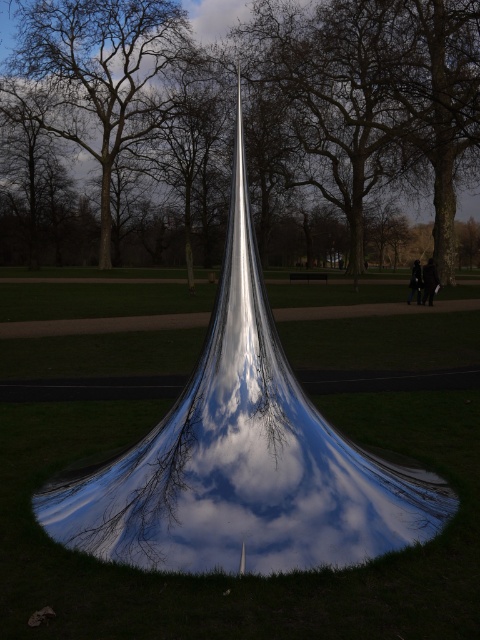
Which of these two, shiny metallic sculpture at center or brown bark tree at center, stands taller?

brown bark tree at center is taller.

Between shiny metallic sculpture at center and brown bark tree at center, which one is positioned higher?

brown bark tree at center

Who is more forward, (169, 420) or (92, 65)?

Point (169, 420)

Locate an element on the screen. shiny metallic sculpture at center is located at coordinates (243, 458).

Can you confirm if smooth bark tree at center is wider than brown bark tree at center?

Yes.

Is smooth bark tree at center shorter than brown bark tree at center?

No.

Which is in front, point (182, 218) or point (35, 49)?

Point (182, 218)

Where is `smooth bark tree at center`? This screenshot has height=640, width=480. smooth bark tree at center is located at coordinates (230, 125).

Does point (420, 148) come farther from viewer compared to point (156, 484)?

Yes, it is.

Is smooth bark tree at center positioned before shiny metallic sculpture at center?

No.

You are a GUI agent. You are given a task and a screenshot of the screen. Output one action in this format:
    pyautogui.click(x=<x>, y=<y>)
    Task: Click on the smooth bark tree at center
    
    Given the screenshot: What is the action you would take?
    pyautogui.click(x=230, y=125)

This screenshot has height=640, width=480. In order to click on smooth bark tree at center in this screenshot , I will do `click(230, 125)`.